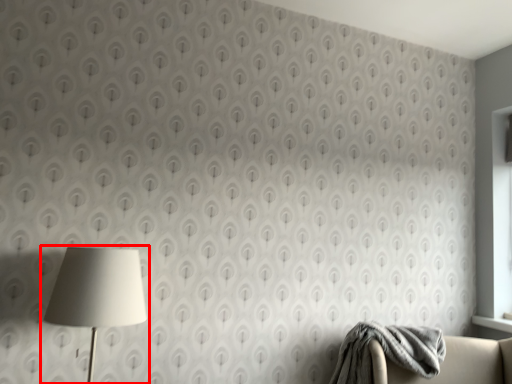
Question: Where is lamp (annotated by the red box) located in relation to blanket in the image?

Choices:
 (A) right
 (B) left

Answer: (B)